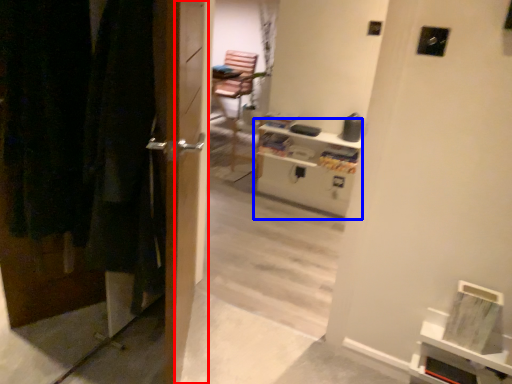
Question: Which object appears farthest to the camera in this image, screen door (highlighted by a red box) or entertainment center (highlighted by a blue box)?

Choices:
 (A) screen door
 (B) entertainment center

Answer: (B)